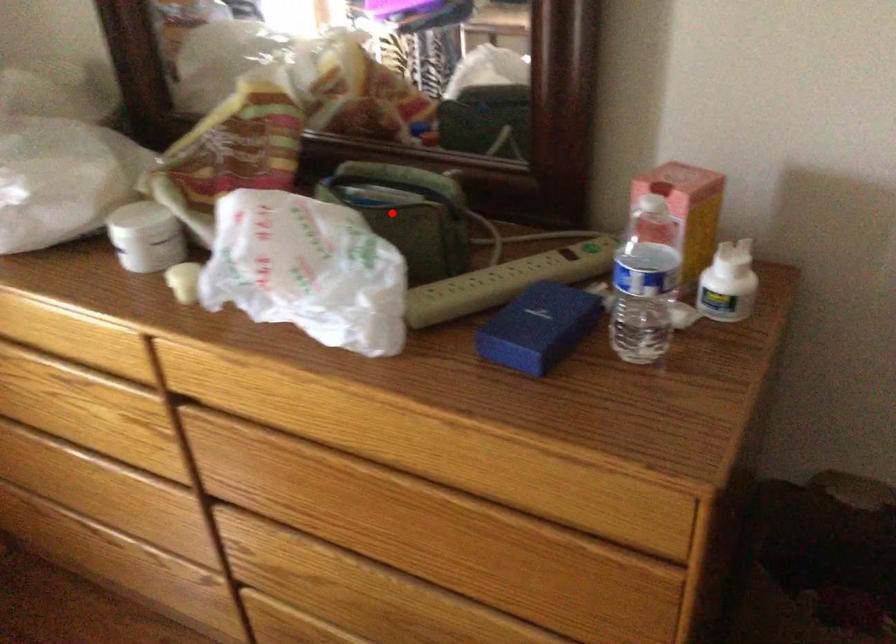
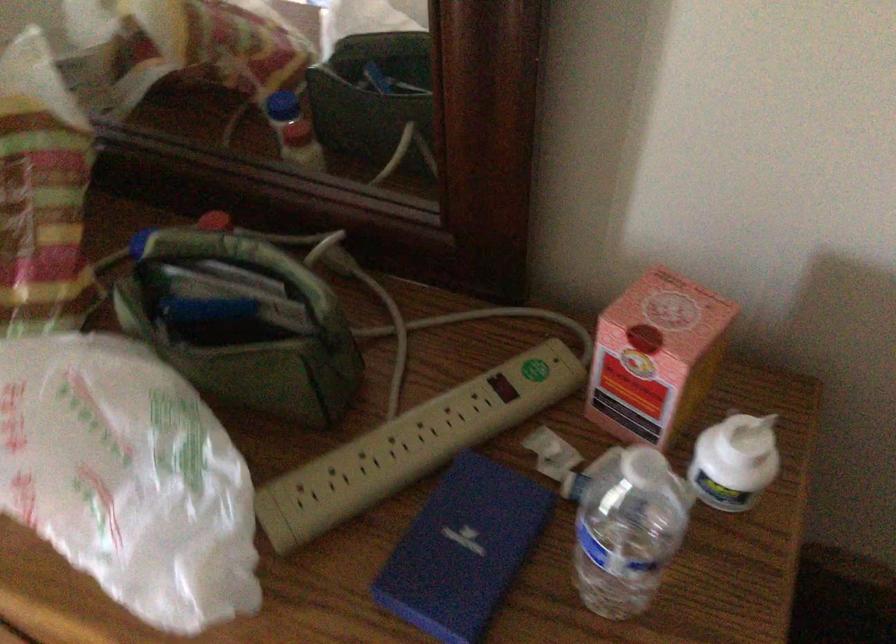
Question: I am providing you with two images of the same scene from different viewpoints. Given a red point in image1, look at the same physical point in image2. Is it:

Choices:
 (A) Closer to the viewpoint
 (B) Farther from the viewpoint

Answer: (A)